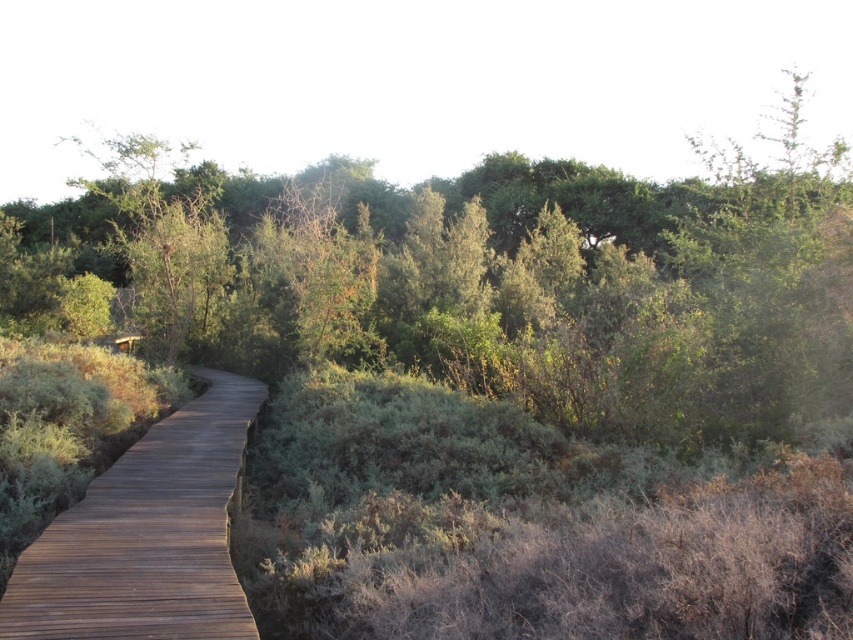
Question: Can you confirm if wooden boardwalk at center is positioned below green leafy tree at upper left?

Choices:
 (A) yes
 (B) no

Answer: (A)

Question: Is wooden boardwalk at center smaller than green leafy tree at upper left?

Choices:
 (A) yes
 (B) no

Answer: (A)

Question: Can you confirm if wooden boardwalk at center is bigger than green leafy tree at upper left?

Choices:
 (A) no
 (B) yes

Answer: (A)

Question: Which point is farther from the camera taking this photo?

Choices:
 (A) (229, 564)
 (B) (160, 172)

Answer: (B)

Question: Which of the following is the closest to the observer?

Choices:
 (A) coord(97,625)
 (B) coord(161,326)

Answer: (A)

Question: Among these points, which one is farthest from the camera?

Choices:
 (A) (169, 236)
 (B) (231, 436)

Answer: (A)